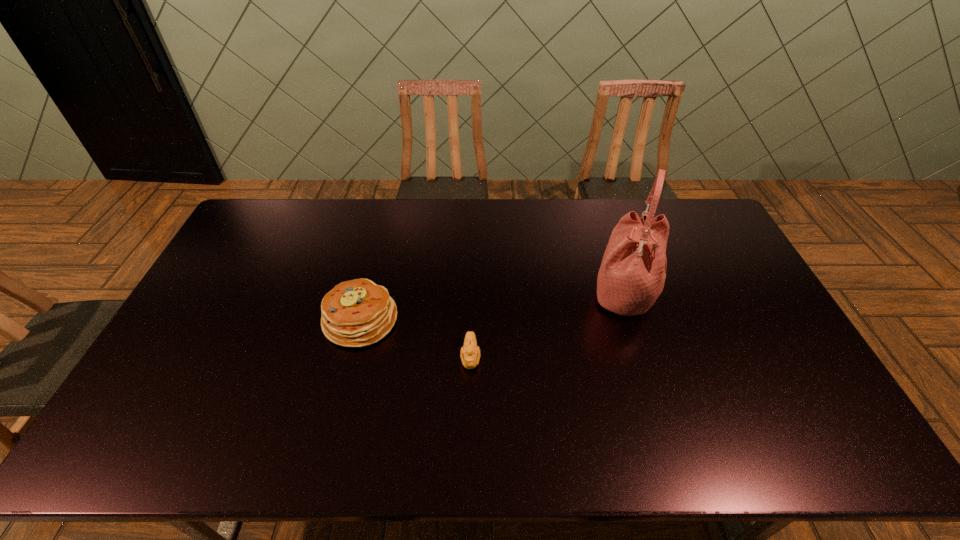
Where is `free space that is in between the tallest object and the pancake`? Image resolution: width=960 pixels, height=540 pixels. free space that is in between the tallest object and the pancake is located at coordinates pos(492,306).

Identify the location of free spot between the second object from left to right and the pancake. This screenshot has height=540, width=960. (416, 339).

Locate an element on the screen. free space between the leftmost object and the shortest object is located at coordinates (416, 339).

Find the location of `object that is the closest one to the leftmost object`. object that is the closest one to the leftmost object is located at coordinates (470, 354).

Choose which object is the nearest neighbor to the tallest object. Please provide its 2D coordinates. Your answer should be formatted as a tuple, i.e. [(x, y)], where the tuple contains the x and y coordinates of a point satisfying the conditions above.

[(470, 354)]

Locate an element on the screen. The width and height of the screenshot is (960, 540). vacant region that satisfies the following two spatial constraints: 1. on the back side of the second tallest object; 2. on the left side of the rightmost object is located at coordinates (368, 292).